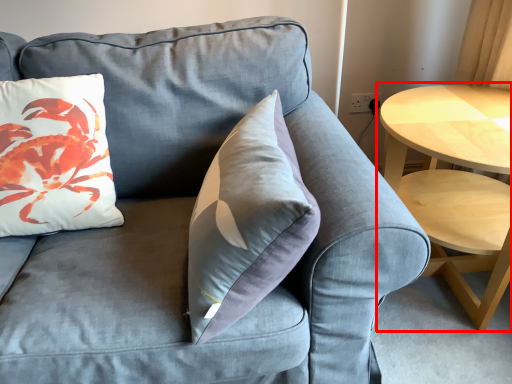
Question: Where is coffee table (annotated by the red box) located in relation to pillow in the image?

Choices:
 (A) left
 (B) right

Answer: (B)